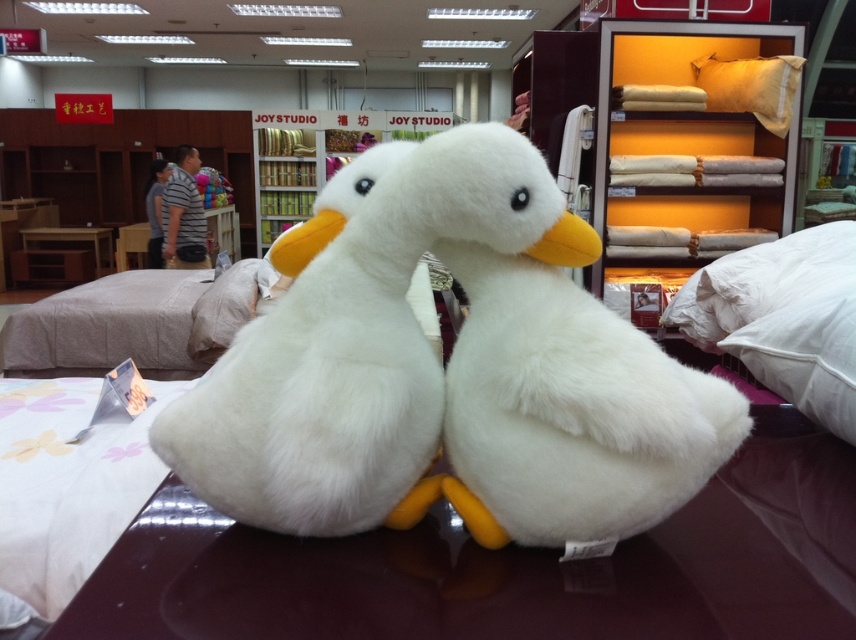
You are a delivery person who needs to place a beige soft pillow at upper right on the wooden table at center. Based on the scene description, will the pillow fit on the table without overhanging the edges?

The beige soft pillow at upper right has a width that is less than the wooden table at center, so it will fit without overhanging the edges.

You are a customer in the store and want to locate the white fluffy pillow at right. According to the store layout, where would you find it?

The white fluffy pillow at right is located at point 0.552 on the x axis and 0.944 on the y axis.